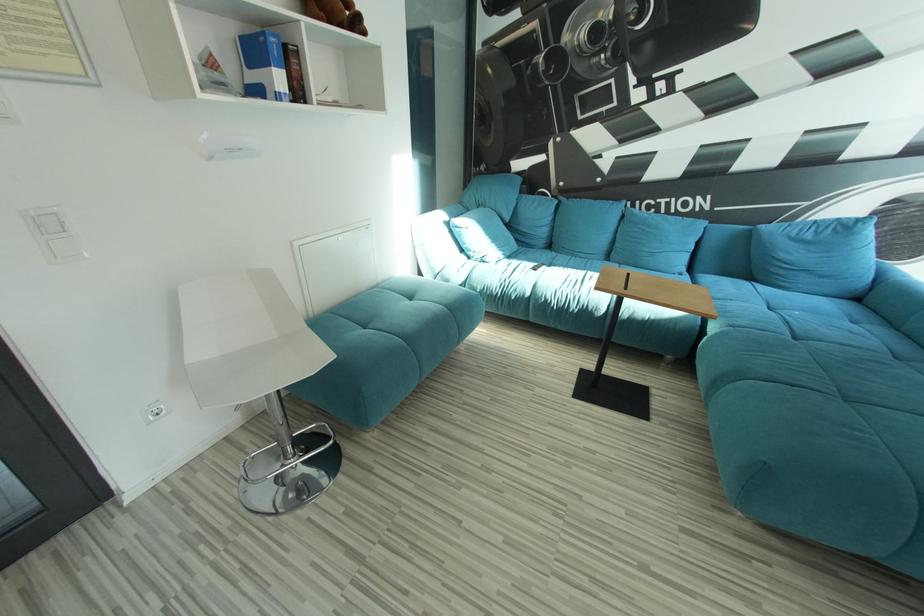
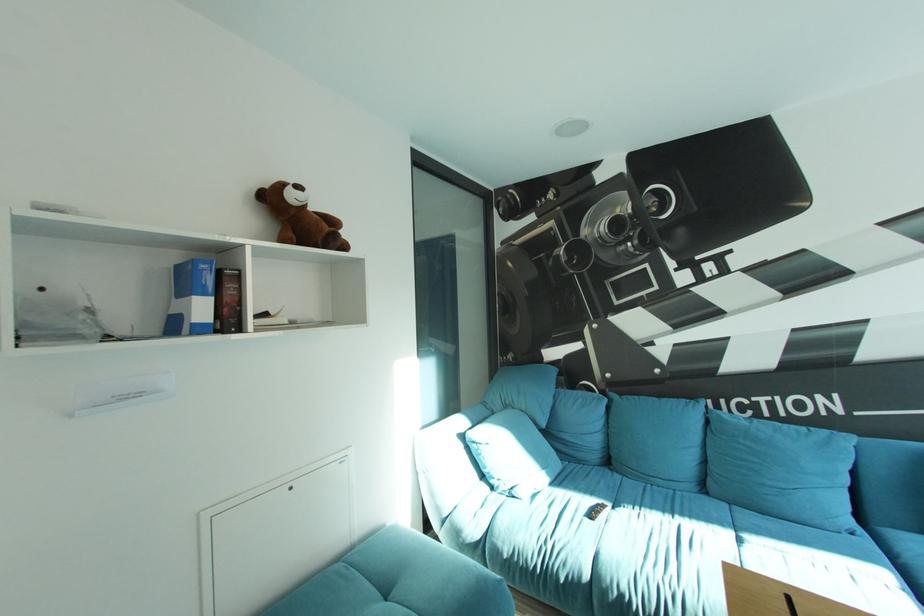
Question: The images are taken continuously from a first-person perspective. In which direction are you moving?

Choices:
 (A) Left
 (B) Right
 (C) Forward
 (D) Backward

Answer: (C)